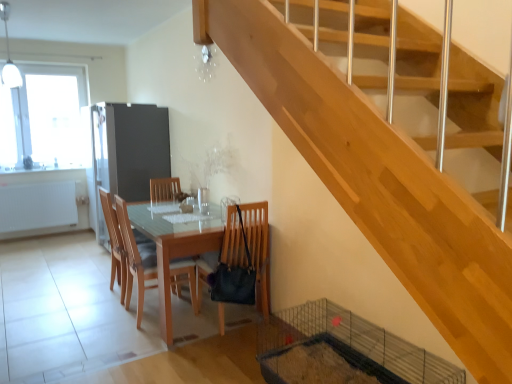
What are the coordinates of `metallic silver screen door at center left` in the screenshot? It's located at (130, 148).

Find the location of a particular element. wooden chair at center, positioned as the 1th chair in right-to-left order is located at coordinates [x=258, y=250].

I want to click on wooden chair at center, which is counted as the third chair, starting from the right, so click(115, 242).

You are a GUI agent. You are given a task and a screenshot of the screen. Output one action in this format:
    pyautogui.click(x=<x>, y=<y>)
    Task: Click on the transparent glass window at upper left
    Image resolution: width=512 pixels, height=384 pixels.
    Given the screenshot: What is the action you would take?
    pyautogui.click(x=42, y=116)

Considering the relative sizes of wooden chair at center, which ranks as the 3th chair in left-to-right order, and metallic silver screen door at center left in the image provided, is wooden chair at center, which ranks as the 3th chair in left-to-right order, shorter than metallic silver screen door at center left?

Yes.

Is wooden chair at center, which ranks as the 3th chair in left-to-right order, positioned beyond the bounds of metallic silver screen door at center left?

Yes, wooden chair at center, which ranks as the 3th chair in left-to-right order, is outside of metallic silver screen door at center left.

Is wooden chair at center, positioned as the 1th chair in right-to-left order, next to metallic silver screen door at center left?

No, wooden chair at center, positioned as the 1th chair in right-to-left order, is not in contact with metallic silver screen door at center left.

Which of these two, wooden chair at center, positioned as the 1th chair in right-to-left order, or metallic silver screen door at center left, is smaller?

With smaller size is wooden chair at center, positioned as the 1th chair in right-to-left order.

Is matte wooden table at center aimed at wooden chair at center, the 2th chair in the right-to-left sequence?

Yes, matte wooden table at center is turned towards wooden chair at center, the 2th chair in the right-to-left sequence.

How far apart are matte wooden table at center and wooden chair at center, the 2th chair in the right-to-left sequence?

They are 22.60 centimeters apart.

Which of these two, matte wooden table at center or wooden chair at center, the 2th chair from the left, stands shorter?

matte wooden table at center.

Considering the positions of objects matte wooden table at center and wooden chair at center, the 2th chair from the left, in the image provided, who is more to the right, matte wooden table at center or wooden chair at center, the 2th chair from the left,?

matte wooden table at center is more to the right.

From a real-world perspective, who is located lower, transparent glass window at upper left or wooden chair at center, placed as the 1th chair when sorted from left to right?

wooden chair at center, placed as the 1th chair when sorted from left to right, is physically lower.

Is transparent glass window at upper left oriented towards wooden chair at center, which is counted as the third chair, starting from the right?

Yes.

You are a GUI agent. You are given a task and a screenshot of the screen. Output one action in this format:
    pyautogui.click(x=<x>, y=<y>)
    Task: Click on the window located above the wooden chair at center, placed as the 1th chair when sorted from left to right (from the image's perspective)
    
    Given the screenshot: What is the action you would take?
    pyautogui.click(x=42, y=116)

Visually, is transparent glass window at upper left positioned to the left or to the right of wooden chair at center, placed as the 1th chair when sorted from left to right?

Based on their positions, transparent glass window at upper left is located to the left of wooden chair at center, placed as the 1th chair when sorted from left to right.

Based on their sizes in the image, would you say wooden chair at center, which is counted as the third chair, starting from the right, is bigger or smaller than wooden chair at center, the 2th chair from the left?

Considering their sizes, wooden chair at center, which is counted as the third chair, starting from the right, takes up more space than wooden chair at center, the 2th chair from the left.

Identify the location of chair that is the 1st one when counting rightward from the wooden chair at center, placed as the 1th chair when sorted from left to right. (136, 258).

In the scene shown: From the image's perspective, which is above, wooden chair at center, placed as the 1th chair when sorted from left to right, or wooden chair at center, the 2th chair in the right-to-left sequence?

wooden chair at center, placed as the 1th chair when sorted from left to right, from the image's perspective.

From a real-world perspective, is wooden chair at center, placed as the 1th chair when sorted from left to right, under wooden chair at center, the 2th chair from the left?

Incorrect, from a real-world perspective, wooden chair at center, placed as the 1th chair when sorted from left to right, is higher than wooden chair at center, the 2th chair from the left.

Could you tell me if transparent glass window at upper left is turned towards matte wooden table at center?

Yes, transparent glass window at upper left is facing matte wooden table at center.

From a real-world perspective, is transparent glass window at upper left physically above matte wooden table at center?

Yes.

Is transparent glass window at upper left positioned beyond the bounds of matte wooden table at center?

Yes, transparent glass window at upper left is not within matte wooden table at center.

From the image's perspective, relative to matte wooden table at center, is transparent glass window at upper left above or below?

Clearly, from the image's perspective, transparent glass window at upper left is above matte wooden table at center.

In the scene shown: Is wooden chair at center, which ranks as the 3th chair in left-to-right order, a part of wooden chair at center, the 2th chair from the left?

No.

From a real-world perspective, is wooden chair at center, the 2th chair from the left, physically below wooden chair at center, which ranks as the 3th chair in left-to-right order?

Correct, in the physical world, wooden chair at center, the 2th chair from the left, is lower than wooden chair at center, which ranks as the 3th chair in left-to-right order.

Who is taller, wooden chair at center, the 2th chair in the right-to-left sequence, or wooden chair at center, which ranks as the 3th chair in left-to-right order?

Standing taller between the two is wooden chair at center, the 2th chair in the right-to-left sequence.

Is wooden chair at center, the 2th chair from the left, aimed at wooden chair at center, which ranks as the 3th chair in left-to-right order?

No.

Is wooden chair at center, placed as the 1th chair when sorted from left to right, positioned far away from metallic silver screen door at center left?

Absolutely, wooden chair at center, placed as the 1th chair when sorted from left to right, is distant from metallic silver screen door at center left.

Is wooden chair at center, which is counted as the third chair, starting from the right, inside the boundaries of metallic silver screen door at center left, or outside?

wooden chair at center, which is counted as the third chair, starting from the right, cannot be found inside metallic silver screen door at center left.

This screenshot has height=384, width=512. Find the location of `screen door above the wooden chair at center, which is counted as the third chair, starting from the right (from a real-world perspective)`. screen door above the wooden chair at center, which is counted as the third chair, starting from the right (from a real-world perspective) is located at coordinates (130, 148).

Does wooden chair at center, which is counted as the third chair, starting from the right, appear on the left side of metallic silver screen door at center left?

No, wooden chair at center, which is counted as the third chair, starting from the right, is not to the left of metallic silver screen door at center left.

Image resolution: width=512 pixels, height=384 pixels. Find the location of `screen door that is behind the wooden chair at center, positioned as the 1th chair in right-to-left order`. screen door that is behind the wooden chair at center, positioned as the 1th chair in right-to-left order is located at coordinates (130, 148).

You are a GUI agent. You are given a task and a screenshot of the screen. Output one action in this format:
    pyautogui.click(x=<x>, y=<y>)
    Task: Click on the 1st chair above the matte wooden table at center (from a real-world perspective)
    
    Given the screenshot: What is the action you would take?
    pyautogui.click(x=136, y=258)

Estimate the real-world distances between objects in this image. Which object is closer to transparent glass window at upper left, wooden chair at center, placed as the 1th chair when sorted from left to right, or metallic silver screen door at center left?

metallic silver screen door at center left is positioned closer to the anchor transparent glass window at upper left.

From the picture: From the image, which object appears to be nearer to metallic silver screen door at center left, wooden chair at center, placed as the 1th chair when sorted from left to right, or wooden chair at center, the 2th chair in the right-to-left sequence?

The object closer to metallic silver screen door at center left is wooden chair at center, placed as the 1th chair when sorted from left to right.

Looking at the image, which one is located closer to metallic silver screen door at center left, wooden chair at center, which is counted as the third chair, starting from the right, or wooden chair at center, positioned as the 1th chair in right-to-left order?

Based on the image, wooden chair at center, which is counted as the third chair, starting from the right, appears to be nearer to metallic silver screen door at center left.

Based on their spatial positions, is metallic silver screen door at center left or wooden chair at center, which ranks as the 3th chair in left-to-right order, closer to matte wooden table at center?

wooden chair at center, which ranks as the 3th chair in left-to-right order, is closer to matte wooden table at center.

Which object lies further to the anchor point wooden chair at center, positioned as the 1th chair in right-to-left order, metallic silver screen door at center left or wooden chair at center, the 2th chair in the right-to-left sequence?

Based on the image, metallic silver screen door at center left appears to be further to wooden chair at center, positioned as the 1th chair in right-to-left order.

Looking at the image, which one is located closer to matte wooden table at center, wooden chair at center, placed as the 1th chair when sorted from left to right, or wooden chair at center, which ranks as the 3th chair in left-to-right order?

The object closer to matte wooden table at center is wooden chair at center, which ranks as the 3th chair in left-to-right order.

Based on the photo, from the image, which object appears to be nearer to wooden chair at center, which is counted as the third chair, starting from the right, metallic silver screen door at center left or wooden chair at center, which ranks as the 3th chair in left-to-right order?

wooden chair at center, which ranks as the 3th chair in left-to-right order, is positioned closer to the anchor wooden chair at center, which is counted as the third chair, starting from the right.

Which object lies further to the anchor point matte wooden table at center, wooden chair at center, the 2th chair in the right-to-left sequence, or metallic silver screen door at center left?

metallic silver screen door at center left.

At what (x,y) coordinates should I click in order to perform the action: click on chair positioned between wooden chair at center, the 2th chair in the right-to-left sequence, and metallic silver screen door at center left from near to far. Please return your answer as a coordinate pair (x, y). The height and width of the screenshot is (384, 512). Looking at the image, I should click on (115, 242).

Find the location of a particular element. The height and width of the screenshot is (384, 512). kitchen & dining room table between wooden chair at center, placed as the 1th chair when sorted from left to right, and wooden chair at center, which ranks as the 3th chair in left-to-right order is located at coordinates (175, 247).

Find the location of a particular element. screen door located between wooden chair at center, the 2th chair in the right-to-left sequence, and transparent glass window at upper left in the depth direction is located at coordinates (130, 148).

Where is `screen door between matte wooden table at center and transparent glass window at upper left from front to back`? screen door between matte wooden table at center and transparent glass window at upper left from front to back is located at coordinates (130, 148).